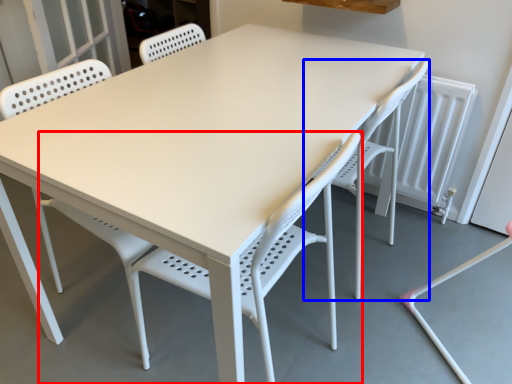
Question: Which object is closer to the camera taking this photo, chair (highlighted by a red box) or swivel chair (highlighted by a blue box)?

Choices:
 (A) chair
 (B) swivel chair

Answer: (A)